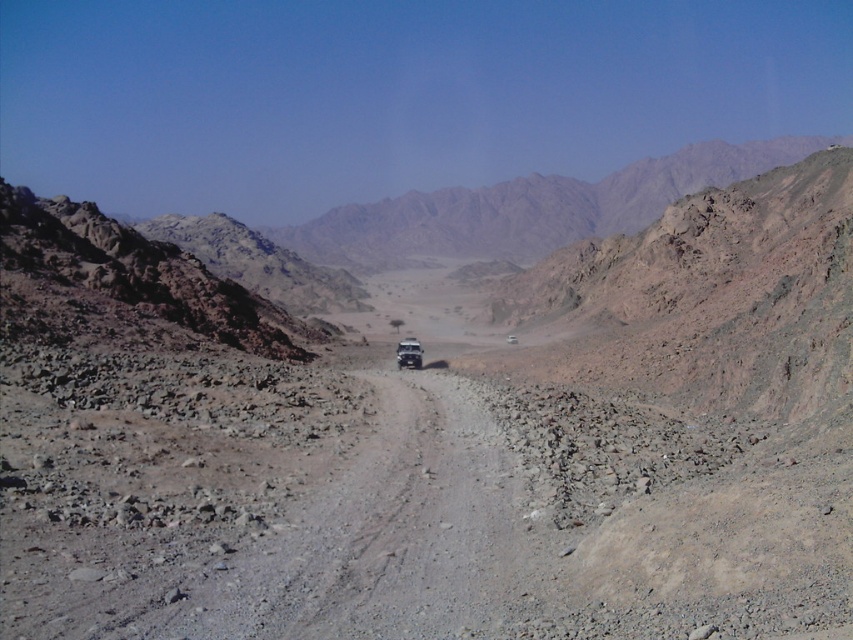
You are a drone operator trying to land a drone on a specific point in the desert. The point is labeled as point (677, 164). Given that the drone can only land within 1000 meters of the camera, will it be able to land on that point?

Point (677, 164) is 936.98 meters from the camera, which is within the 1000 meters range. Therefore, the drone can land on that point.

You are planning a road trip and see the rugged brown mountain at center and the metallic silver suv at center in the image. Which one appears wider in the scene?

The rugged brown mountain at center appears wider than the metallic silver suv at center because its width is larger than the suv.

You are a driver navigating through the desert and see the rugged brown mountain at center and the metallic silver suv at center. Which vehicle is closer to you?

The rugged brown mountain at center is closer to you than the metallic silver suv at center, so the metallic silver suv at center is further away.